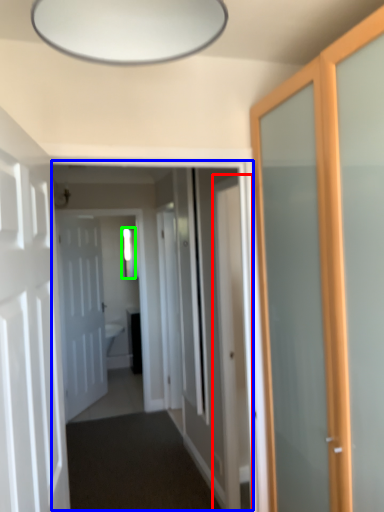
Question: Which object is the farthest from door (highlighted by a red box)? Choose among these: corridor (highlighted by a blue box) or window (highlighted by a green box).

Choices:
 (A) corridor
 (B) window

Answer: (B)